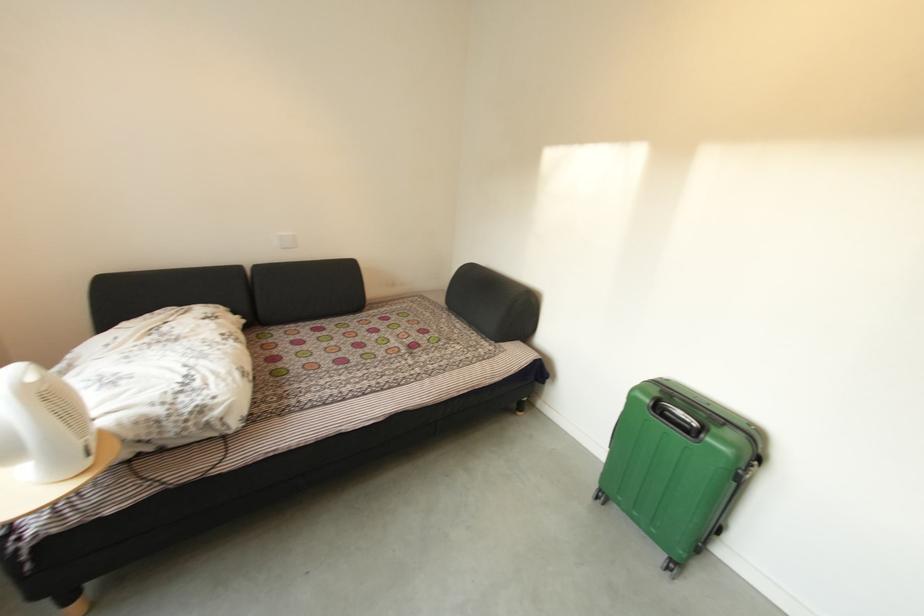
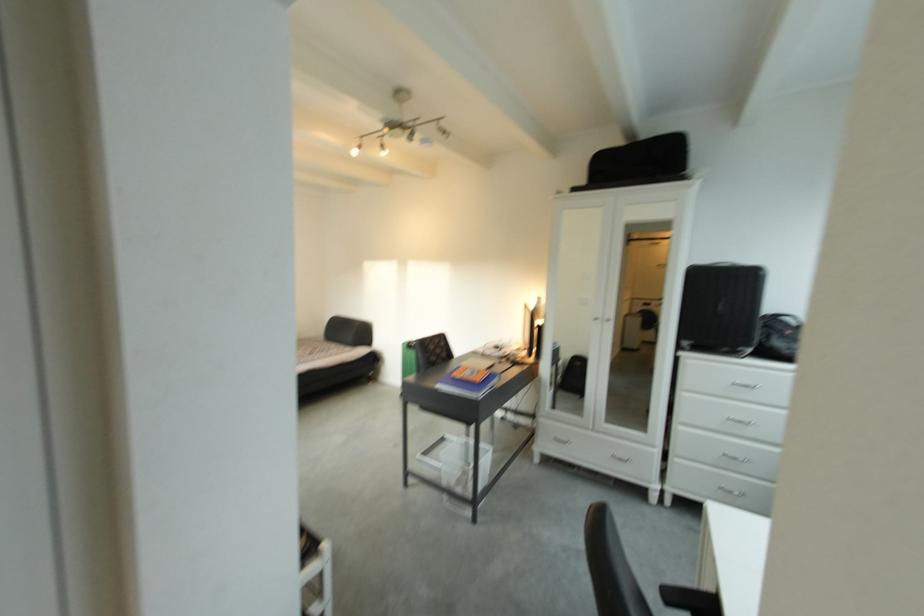
Question: The images are taken continuously from a first-person perspective. In which direction are you moving?

Choices:
 (A) Left
 (B) Right
 (C) Forward
 (D) Backward

Answer: (D)